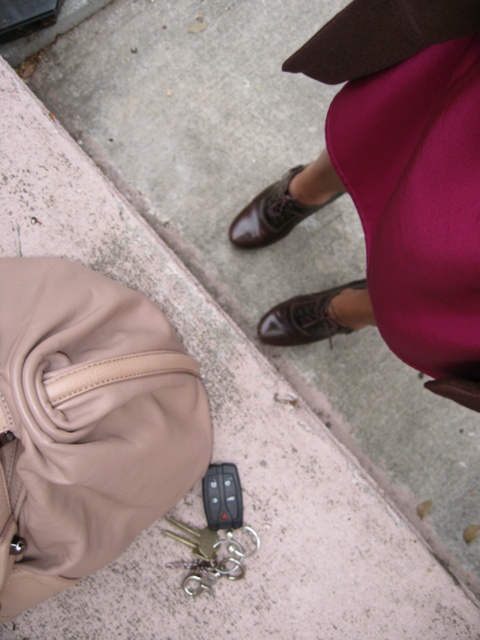
Can you confirm if tan leather handbag at lower left is positioned to the right of shiny brown shoe at center?

In fact, tan leather handbag at lower left is to the left of shiny brown shoe at center.

Does tan leather handbag at lower left have a lesser height compared to shiny brown shoe at center?

No, tan leather handbag at lower left is not shorter than shiny brown shoe at center.

Does point (168, 381) come closer to viewer compared to point (352, 285)?

That is True.

The image size is (480, 640). In order to click on tan leather handbag at lower left in this screenshot , I will do `click(86, 422)`.

Describe the element at coordinates (304, 317) in the screenshot. This screenshot has width=480, height=640. I see `shiny brown shoe at center` at that location.

Is point (297, 332) positioned after point (236, 228)?

No.

Where is `shiny brown shoe at center`? Image resolution: width=480 pixels, height=640 pixels. shiny brown shoe at center is located at coordinates (304, 317).

Where is `brown leather shoes at center`? Image resolution: width=480 pixels, height=640 pixels. brown leather shoes at center is located at coordinates (393, 186).

Does brown leather shoes at center have a lesser width compared to tan leather handbag at lower left?

Correct, brown leather shoes at center's width is less than tan leather handbag at lower left's.

Does point (279, 209) come behind point (0, 561)?

Yes, it is.

Image resolution: width=480 pixels, height=640 pixels. I want to click on brown leather shoes at center, so click(393, 186).